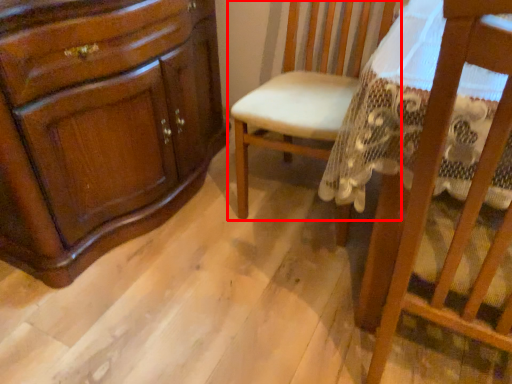
Question: From the image's perspective, where is chair (annotated by the red box) located in relation to chair in the image?

Choices:
 (A) below
 (B) above

Answer: (B)